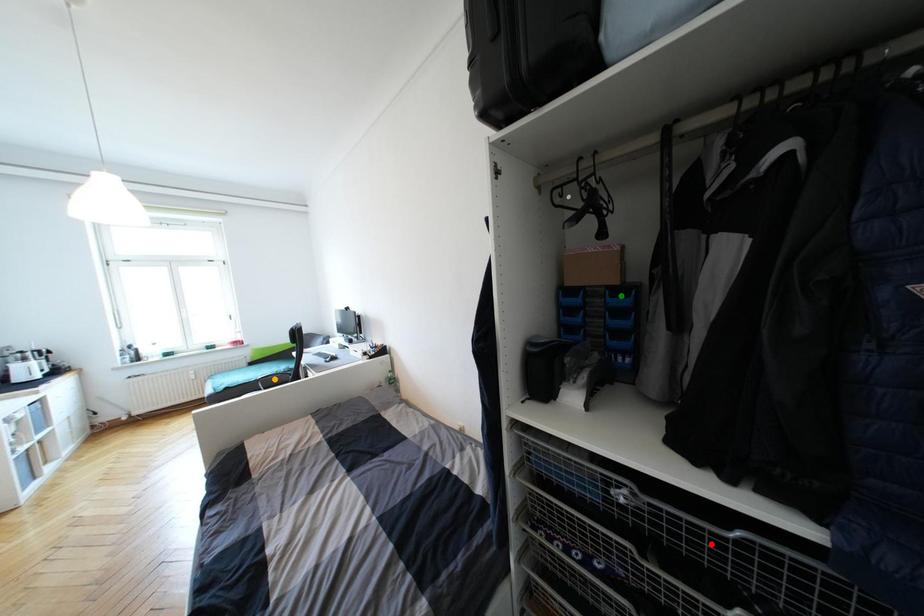
Order these from nearest to farthest:
- red point
- green point
- orange point

red point, green point, orange point